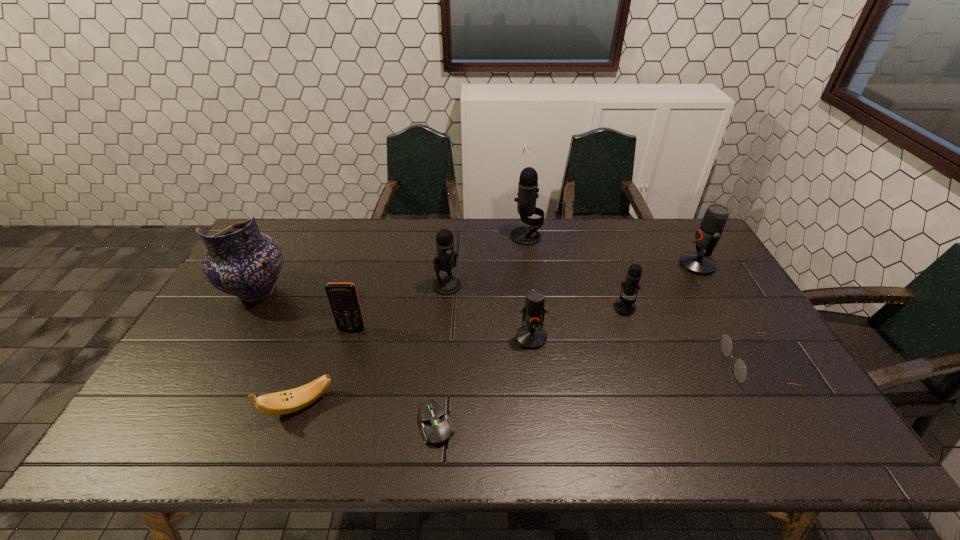
This screenshot has width=960, height=540. Identify the location of blank space located 0.180m on the front of the pottery. (215, 366).

Where is `vacant space located 0.310m on the side of the fourth nearest microphone with the red ring`? vacant space located 0.310m on the side of the fourth nearest microphone with the red ring is located at coordinates (587, 265).

Identify the location of vacant space situated 0.100m on the side of the fourth nearest microphone with the red ring. (650, 265).

The image size is (960, 540). I want to click on free spot located on the side of the fourth nearest microphone with the red ring, so click(x=596, y=265).

Locate an element on the screen. vacant region located on the right of the leftmost black microphone is located at coordinates (575, 285).

I want to click on vacant position located on the screen of the orange cellular telephone, so click(336, 382).

Locate an element on the screen. This screenshot has width=960, height=540. vacant space located 0.050m on the left of the fourth farthest microphone is located at coordinates (597, 308).

At what (x,y) coordinates should I click in order to perform the action: click on vacant space located on the side of the nearest microphone with the red ring. Please return your answer as a coordinate pair (x, y). This screenshot has height=540, width=960. Looking at the image, I should click on (536, 377).

The height and width of the screenshot is (540, 960). I want to click on vacant region located 0.300m on the back of the banana, so click(x=335, y=303).

Find the location of a particular element. vacant point located 0.380m on the temples of the second shortest object is located at coordinates (581, 365).